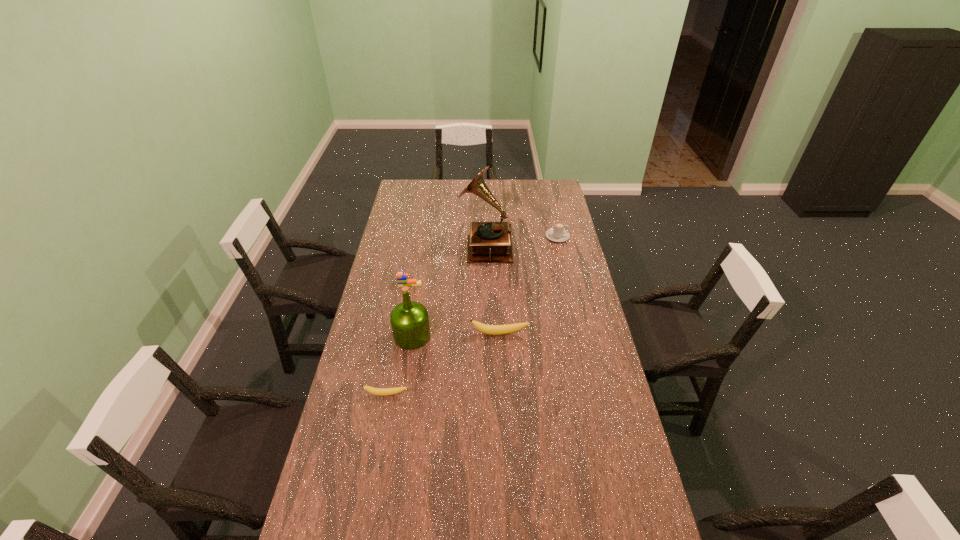
At what (x,y) coordinates should I click in order to perform the action: click on the left banana. Please return your answer as a coordinate pair (x, y). Looking at the image, I should click on (375, 391).

Image resolution: width=960 pixels, height=540 pixels. I want to click on the shortest object, so click(375, 391).

Where is `the farther banana`? Image resolution: width=960 pixels, height=540 pixels. the farther banana is located at coordinates (509, 328).

The height and width of the screenshot is (540, 960). I want to click on the right banana, so click(509, 328).

I want to click on record player, so click(x=488, y=241).

Where is `cappuccino`? The height and width of the screenshot is (540, 960). cappuccino is located at coordinates (558, 234).

The height and width of the screenshot is (540, 960). What are the coordinates of `Lego` in the screenshot? It's located at (402, 278).

Locate an element on the screen. This screenshot has height=540, width=960. the fourth nearest object is located at coordinates (402, 278).

You are a GUI agent. You are given a task and a screenshot of the screen. Output one action in this format:
    pyautogui.click(x=<x>, y=<y>)
    Task: Click on the olive oil
    
    Given the screenshot: What is the action you would take?
    pyautogui.click(x=409, y=320)

The height and width of the screenshot is (540, 960). In order to click on free spot located 0.100m on the upward curve of the nearer banana in this screenshot , I will do pyautogui.click(x=381, y=424).